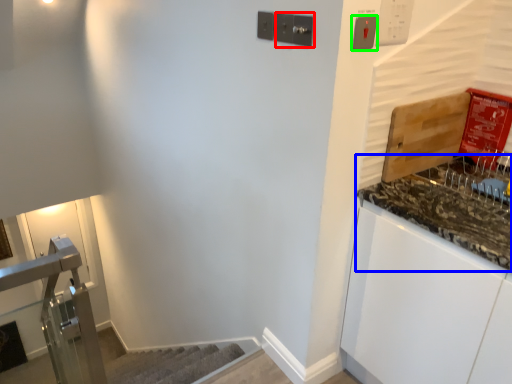
Question: Which is nearer to the light switch (highlighted by a red box)? countertop (highlighted by a blue box) or light switch (highlighted by a green box).

Choices:
 (A) countertop
 (B) light switch

Answer: (B)